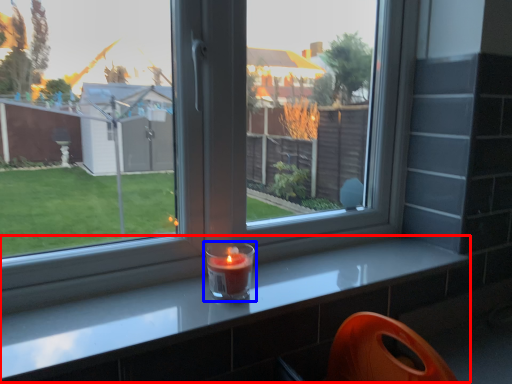
Question: Which point is further to the camera, counter (highlighted by a red box) or candle holder (highlighted by a blue box)?

Choices:
 (A) counter
 (B) candle holder

Answer: (B)